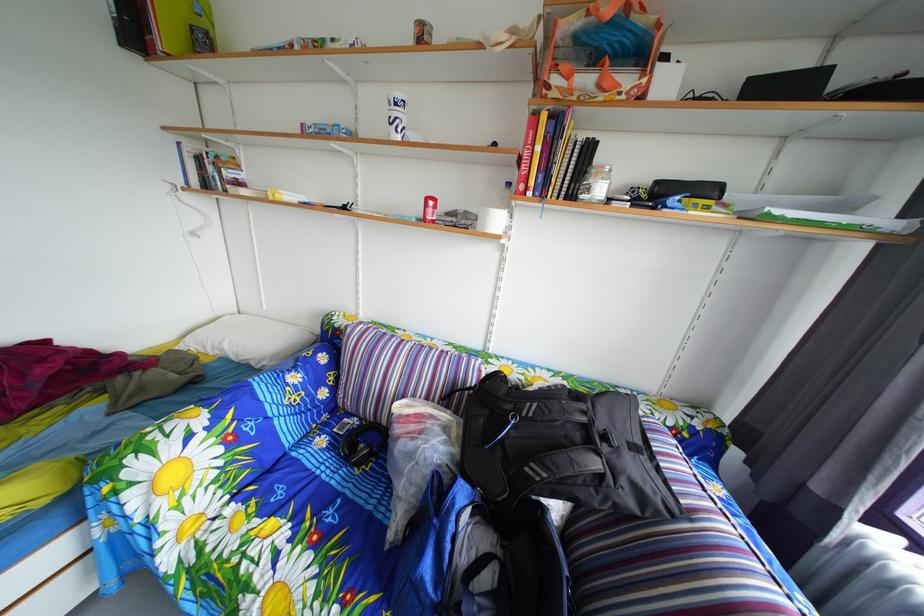
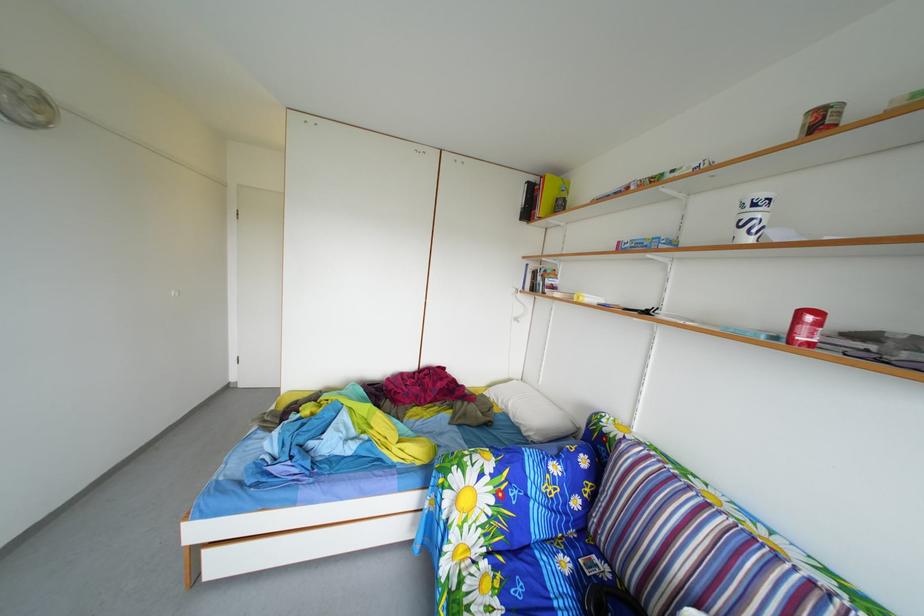
The point at (407, 111) is marked in the first image. Where is the corresponding point in the second image?

(766, 214)